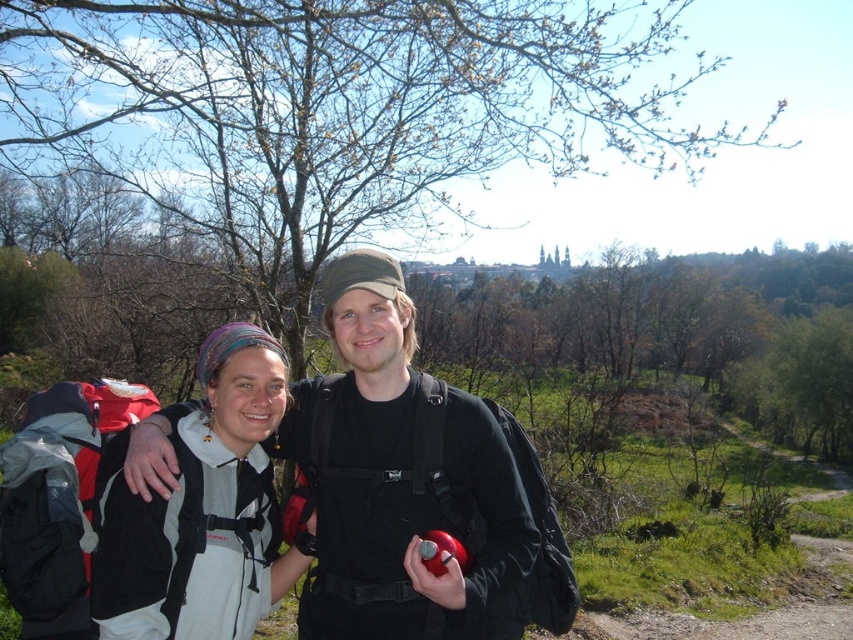
You are a hiker trying to decide which item to grab first from the center of your path. You see the matte black backpack at center and the white fleece jacket at center. Which item is easier to reach without moving closer?

The matte black backpack at center is closer to the viewer than the white fleece jacket at center, so it is easier to reach without moving closer.

You are planning to pack your gear for a day hike and have a space constraint. You need to know which item takes up more space between the matte black backpack at center and the white fleece jacket at center. Which one requires more space?

The matte black backpack at center is bigger than the white fleece jacket at center, so it requires more space.

You are planning to pack your gear for a day hike and need to know which item has more space for carrying items between the matte black backpack at center and the white fleece jacket at center. Based on the image, which one would allow you to carry more items?

The matte black backpack at center has a larger width than the white fleece jacket at center, so it can carry more items.